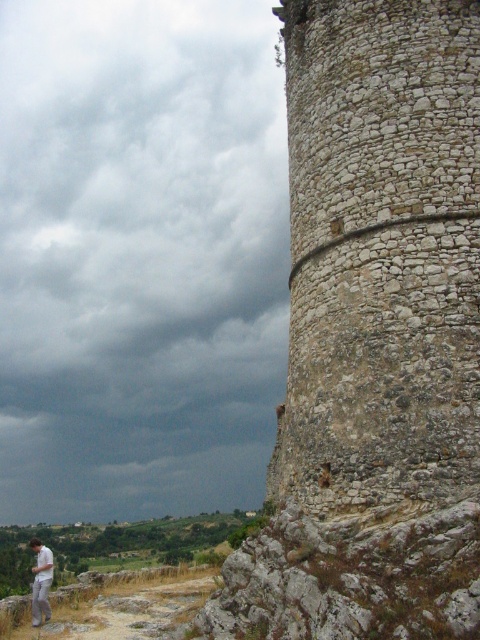
You are standing at the base of the large stone tower on the right and want to take a photo of the dark gray cloud at upper left. Which direction should you face to capture it in your camera?

You should face towards the upper left direction to capture the dark gray cloud at upper left, as it is located at point [139,257] in the image.

You are standing at the base of the large stone tower on the right. You want to take a photo of the point at coordinates point (299,240). If your camera has a maximum zoom range of 30 meters, will you be able to capture the point clearly?

The point at coordinates point (299,240) is 38.36 meters away from the camera, which exceeds the camera maximum zoom range of 30 meters. Therefore, you will not be able to capture the point clearly.